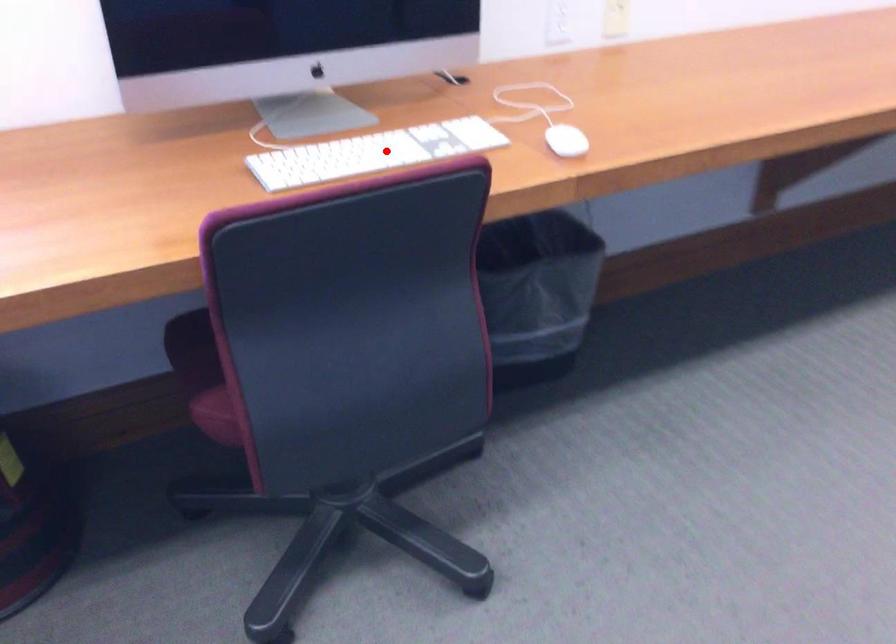
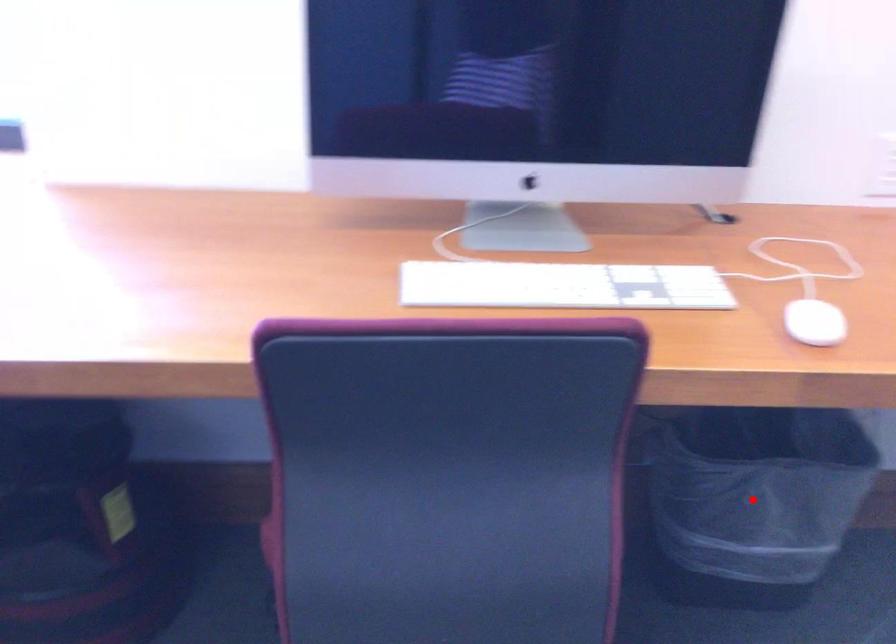
I am providing you with two images of the same scene from different viewpoints. A red point is marked on the first image and another point is marked on the second image. Does the point marked in image1 correspond to the same location as the one in image2?

No